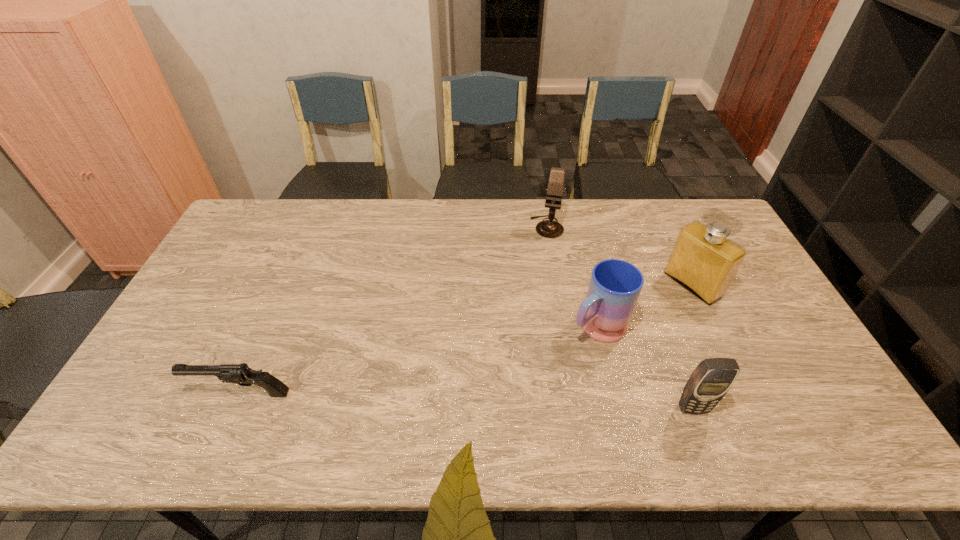
Image resolution: width=960 pixels, height=540 pixels. What are the coordinates of `empty space that is in between the shortest object and the third farthest object` in the screenshot? It's located at (419, 361).

The width and height of the screenshot is (960, 540). I want to click on object that is the third closest to the mug, so click(547, 228).

Locate which object is the closest to the farthest object. Please provide its 2D coordinates. Your answer should be formatted as a tuple, i.e. [(x, y)], where the tuple contains the x and y coordinates of a point satisfying the conditions above.

[(703, 260)]

At what (x,y) coordinates should I click in order to perform the action: click on vacant space that satisfies the following two spatial constraints: 1. on the front side of the farthest object; 2. on the right side of the perfume. Please return your answer as a coordinate pair (x, y). Looking at the image, I should click on (558, 285).